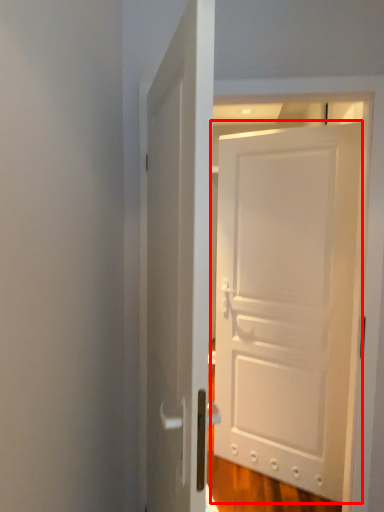
Question: Observing the image, what is the correct spatial positioning of door (annotated by the red box) in reference to door?

Choices:
 (A) right
 (B) left

Answer: (A)